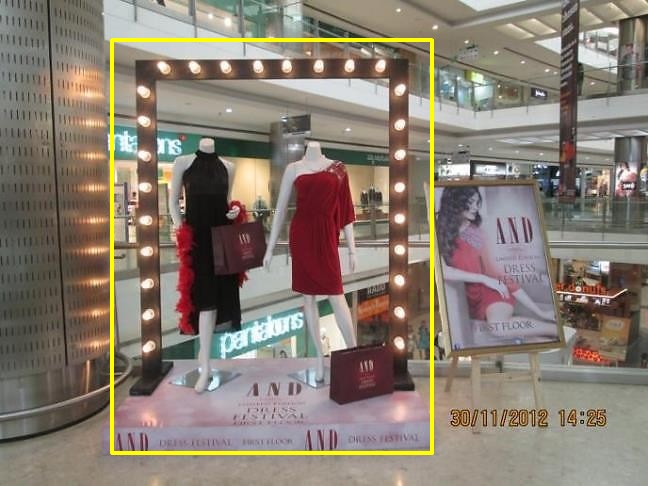
Identify the location of wooden artist easel. (477, 357), (531, 358).